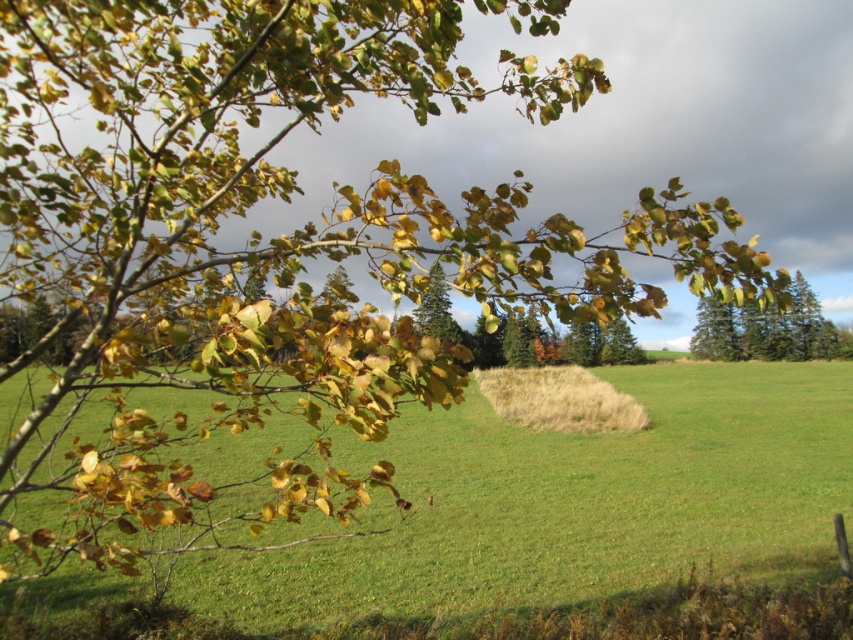
Is dry grass at center smaller than green matte tree at center?

Indeed, dry grass at center has a smaller size compared to green matte tree at center.

Consider the image. Measure the distance between dry grass at center and camera.

The distance of dry grass at center from camera is 29.77 meters.

Identify the location of dry grass at center. The height and width of the screenshot is (640, 853). click(x=560, y=400).

At what (x,y) coordinates should I click in order to perform the action: click on dry grass at center. Please return your answer as a coordinate pair (x, y). Looking at the image, I should click on (560, 400).

Does green grass pasture at lower left come behind dry grass at center?

No.

Can you confirm if green grass pasture at lower left is wider than dry grass at center?

Yes.

Describe the element at coordinates (577, 518) in the screenshot. Image resolution: width=853 pixels, height=640 pixels. I see `green grass pasture at lower left` at that location.

Locate an element on the screen. This screenshot has height=640, width=853. green grass pasture at lower left is located at coordinates (x=577, y=518).

Can you confirm if green matte tree at upper right is positioned to the left of green matte tree at center?

In fact, green matte tree at upper right is to the right of green matte tree at center.

Is point (699, 301) more distant than point (442, 276)?

Yes, it is behind point (442, 276).

Image resolution: width=853 pixels, height=640 pixels. Identify the location of green matte tree at upper right. (767, 330).